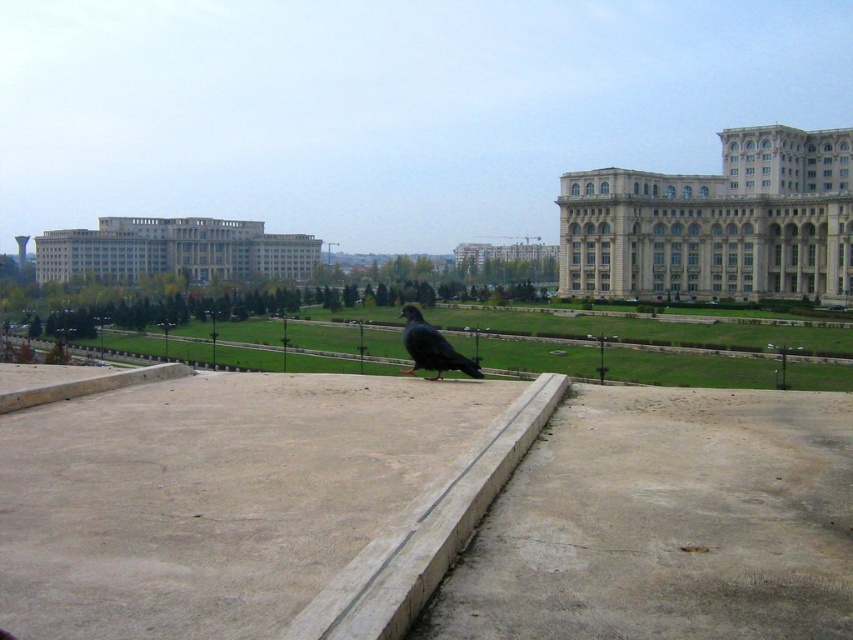
You are standing on the rooftop and want to place a small potted plant on the brown concrete at center. What are the coordinates where you should place it?

The coordinates for the brown concrete at center are at point (x=665, y=524).

You are a gardener who wants to plant flowers on the green grass at center and gray stone building at center. Which area has more space for planting?

The green grass at center has more space for planting since its width is larger than the gray stone building at center.